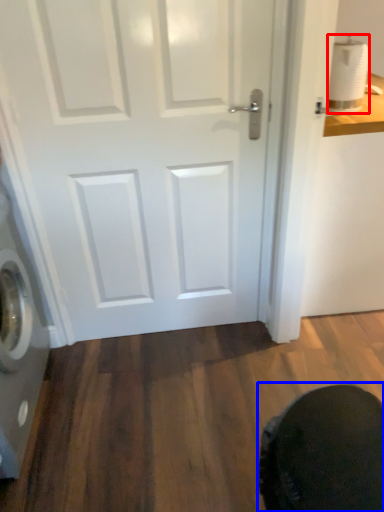
Question: Which of the following is the closest to the observer, toilet paper (highlighted by a red box) or swivel chair (highlighted by a blue box)?

Choices:
 (A) toilet paper
 (B) swivel chair

Answer: (B)